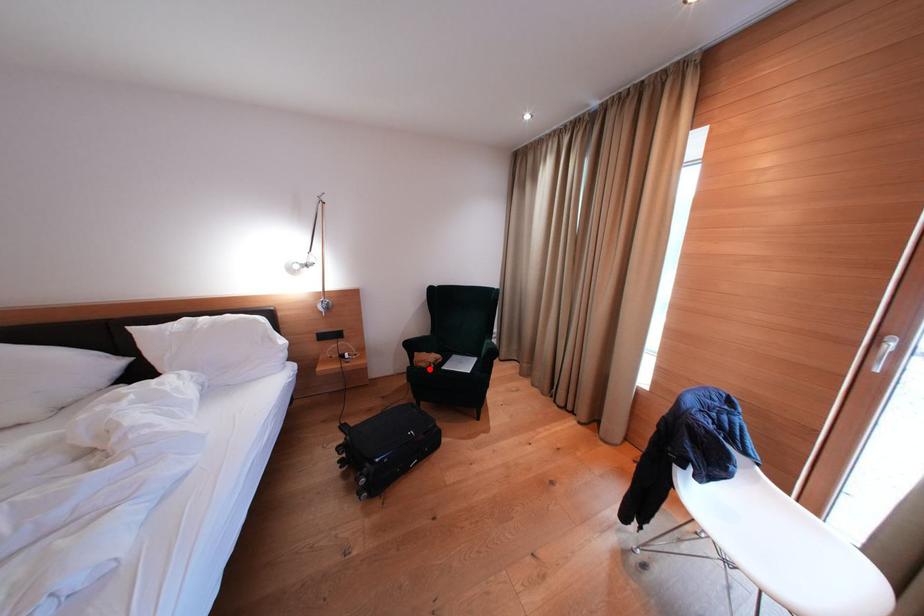
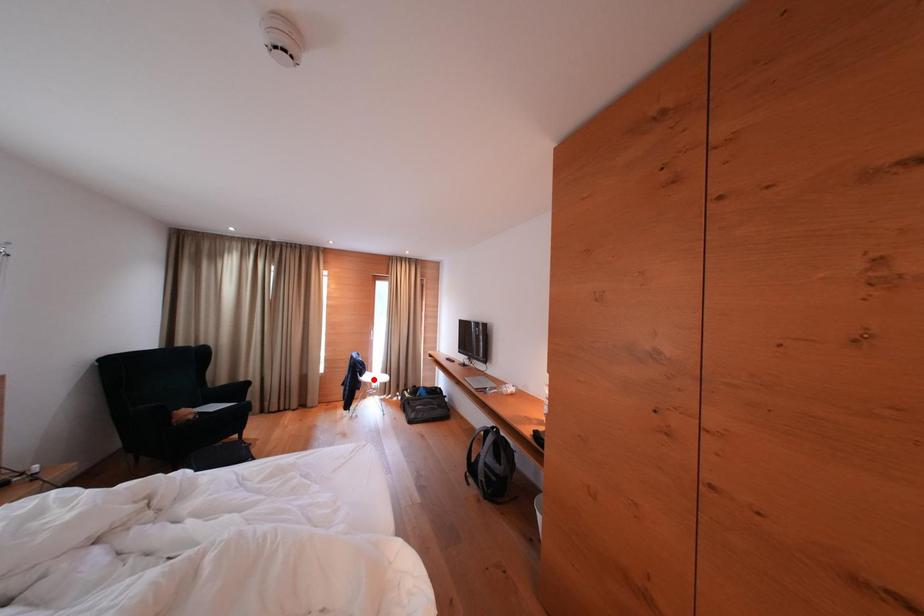
I am providing you with two images of the same scene from different viewpoints. A red point is marked on the first image and another point is marked on the second image. Is the red point in image1 aligned with the point shown in image2?

No